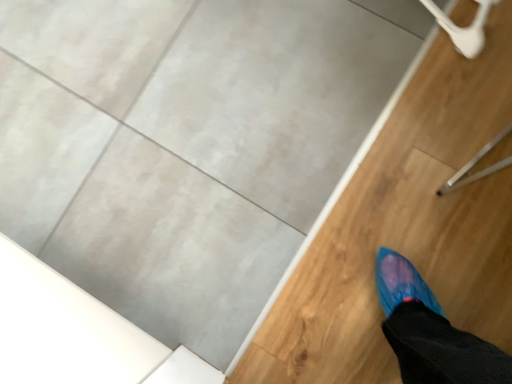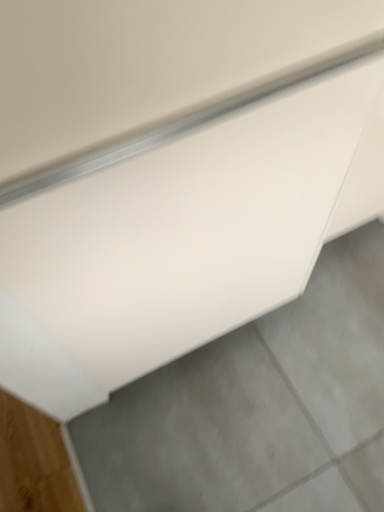
Question: How did the camera likely rotate when shooting the video?

Choices:
 (A) rotated left
 (B) rotated right

Answer: (A)